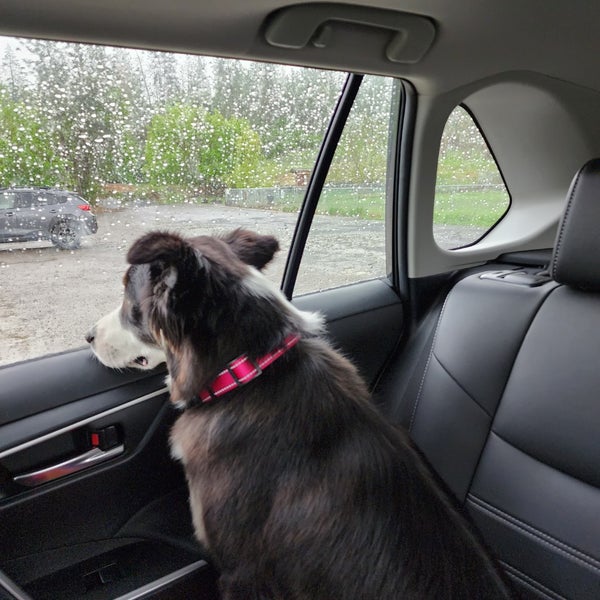
Find the location of a particular element. This screenshot has height=600, width=600. door lock is located at coordinates (106, 437).